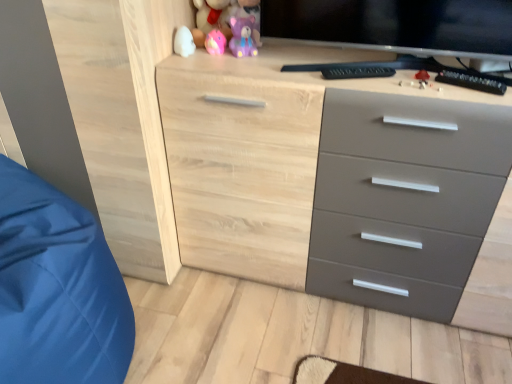
Image resolution: width=512 pixels, height=384 pixels. In order to click on empty space that is to the right of white glossy egg at upper left, positioned as the 4th toy in top-to-bottom order in this screenshot , I will do `click(226, 57)`.